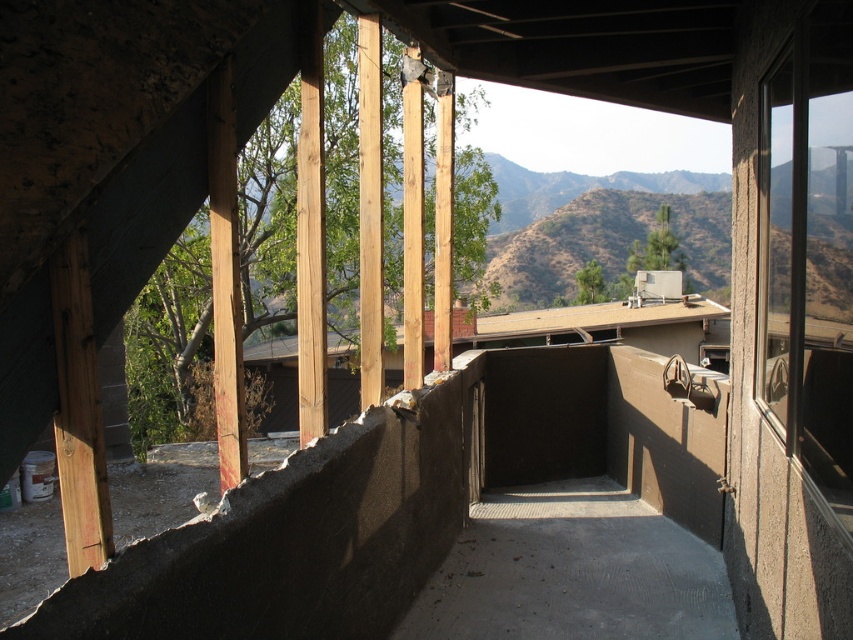
Question: Which object appears closest to the camera in this image?

Choices:
 (A) brown wooden beam at center
 (B) brown wood beam at center

Answer: (B)

Question: Which is farther from the brown wood beam at center?

Choices:
 (A) natural wood beam at center
 (B) light brown wood at center
 (C) light brown wood at upper left
 (D) brown wooden beam at center

Answer: (D)

Question: Does brown wood beam at center appear on the right side of brown wooden beam at center?

Choices:
 (A) no
 (B) yes

Answer: (A)

Question: Is natural wood beam at center bigger than light brown wood at center?

Choices:
 (A) no
 (B) yes

Answer: (B)

Question: Where is natural wood beam at center located in relation to brown wooden beam at center in the image?

Choices:
 (A) below
 (B) above

Answer: (A)

Question: Which point appears closest to the camera in this image?

Choices:
 (A) (444, 349)
 (B) (311, 99)
 (C) (372, 104)
 (D) (412, 196)

Answer: (B)